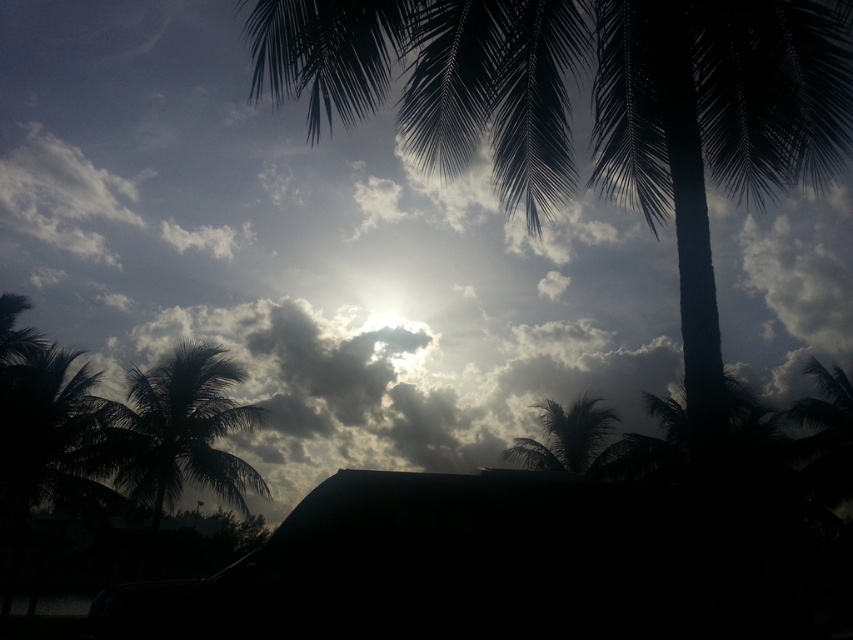
You are a bird flying over the tropical scene. You want to land on the tallest tree to rest. Which tree should you choose between the silhouette leafy tree at center and the silhouette leafy palm at left?

The silhouette leafy palm at left is taller than the silhouette leafy tree at center, so you should choose the silhouette leafy palm at left to land on.

You are an artist trying to paint the tropical scene. You want to ensure the silhouette leafy tree at center and the silky green palm tree at center are proportionally accurate. Which tree should you draw smaller in your painting?

The silhouette leafy tree at center should be drawn smaller than the silky green palm tree at center because the silhouette leafy tree at center has a smaller size compared to silky green palm tree at center.

You are standing in the tropical scene and want to place a small flag at each of the two points marked in the image. The first point is at coordinates point (189, 394) and the second is at point (566, 438). If you want to place the flag closer to your current position, which point should you choose?

You should choose point (189, 394) because it is closer to the camera than point (566, 438), meaning it is nearer to your current position.